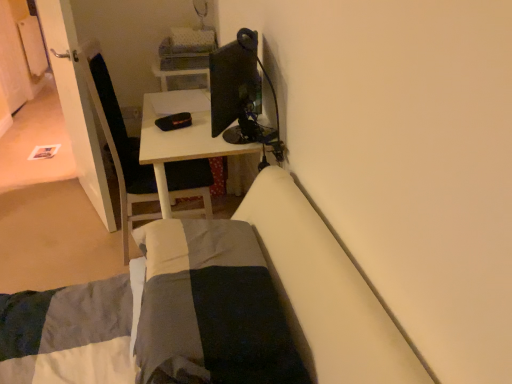
Find the location of a particular element. The width and height of the screenshot is (512, 384). vacant space positioned to the left of matte black monitor at upper center is located at coordinates (198, 134).